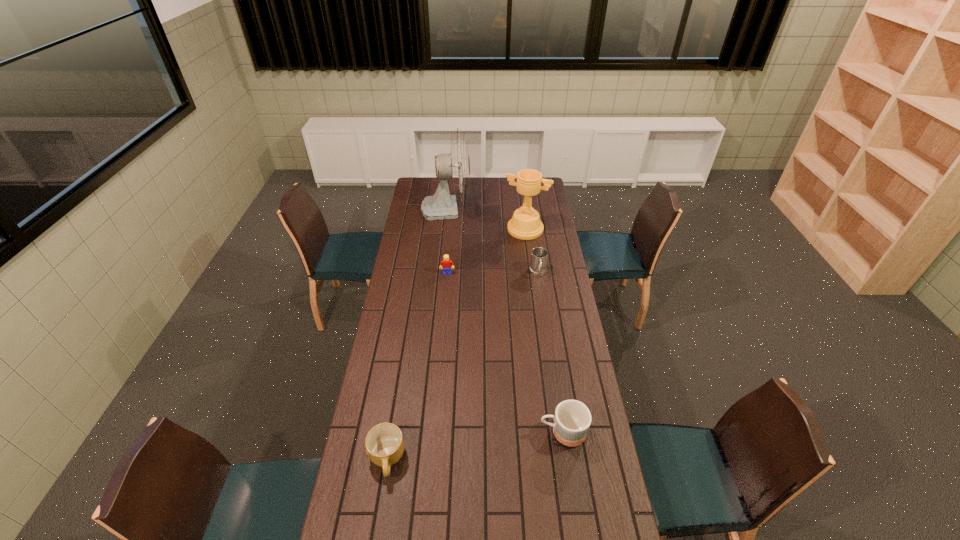
Find the location of a particular element. free point between the award and the Lego is located at coordinates (487, 251).

Image resolution: width=960 pixels, height=540 pixels. What are the coordinates of `unoccupied position between the Lego and the shortest object` in the screenshot? It's located at (417, 366).

Locate an element on the screen. The width and height of the screenshot is (960, 540). vacant area that lies between the award and the shortest mug is located at coordinates (456, 344).

Where is `free space between the farthest mug and the fan`? This screenshot has width=960, height=540. free space between the farthest mug and the fan is located at coordinates (492, 240).

At what (x,y) coordinates should I click in order to perform the action: click on free area in between the Lego and the farthest mug. Please return your answer as a coordinate pair (x, y). The height and width of the screenshot is (540, 960). Looking at the image, I should click on (492, 273).

What are the coordinates of `free spot between the shortest object and the farthest mug` in the screenshot? It's located at (463, 366).

Locate an element on the screen. This screenshot has width=960, height=540. free space between the farthest mug and the shortest object is located at coordinates 463,366.

Image resolution: width=960 pixels, height=540 pixels. In order to click on object that is the fourth closest to the award in this screenshot , I will do `click(572, 419)`.

Image resolution: width=960 pixels, height=540 pixels. What are the coordinates of `object that is the third closest to the second tallest object` in the screenshot? It's located at (446, 264).

I want to click on mug that is the second closest to the farthest mug, so click(x=384, y=443).